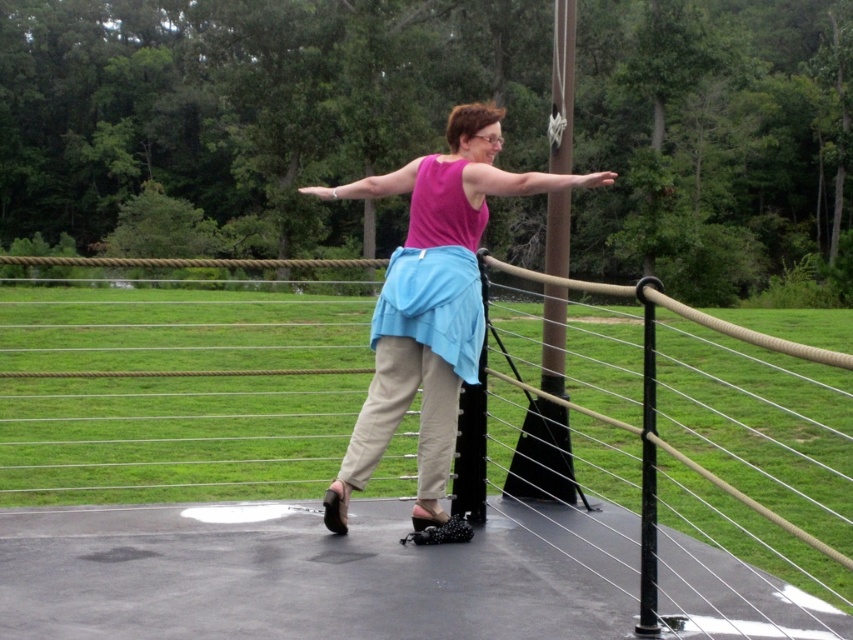
You are a safety inspector checking the platform. The platform has a ropematerialfence at center and a pink fabric skirt at center. According to safety regulations, the fence must be taller than any loose fabric to prevent entanglement. Is the current setup compliant?

The ropematerialfence at center is shorter than the pink fabric skirt at center, so the setup is not compliant with safety regulations because the fence is not taller than the loose fabric.

You are a safety inspector checking the platform. The pink fabric skirt at center must not extend beyond the ropematerialfence at center for safety reasons. Is this requirement currently being met?

The pink fabric skirt at center extends beyond the ropematerialfence at center because the pink fabric skirt at center occupies more space than the ropematerialfence at center. This violates the safety requirement.